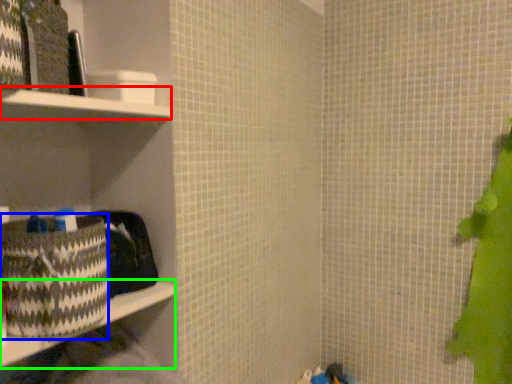
Question: Which is farther away from cabinet (highlighted by a red box)? waste (highlighted by a blue box) or ledge (highlighted by a green box)?

Choices:
 (A) waste
 (B) ledge

Answer: (B)